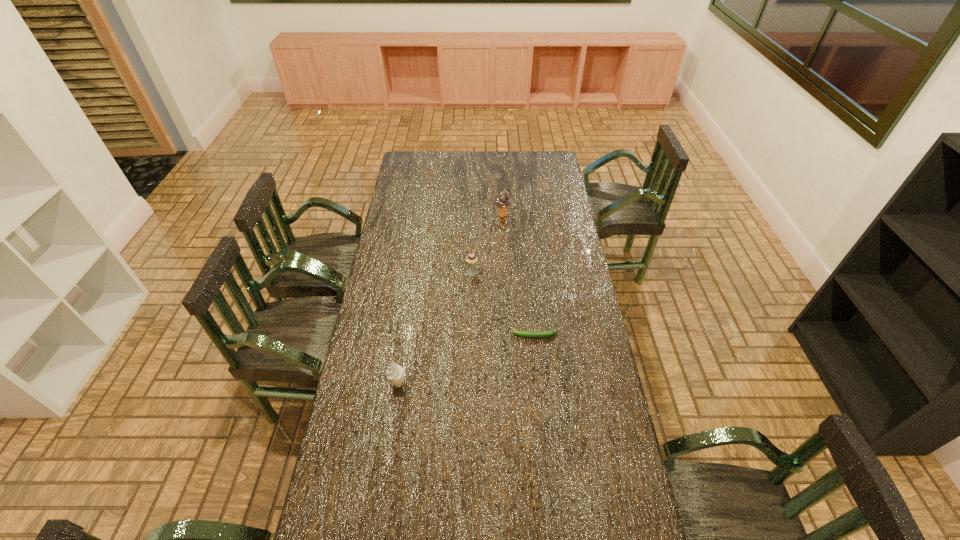
This screenshot has width=960, height=540. I want to click on vacant space at the far right corner of the desktop, so click(538, 170).

I want to click on free point between the nearest object and the farthest object, so click(450, 300).

Image resolution: width=960 pixels, height=540 pixels. In order to click on vacant point located between the farthest object and the nearest icecream in this screenshot , I will do `click(450, 300)`.

Where is `blank region between the leftmost icecream and the shortest object`? Image resolution: width=960 pixels, height=540 pixels. blank region between the leftmost icecream and the shortest object is located at coordinates (467, 360).

The image size is (960, 540). What are the coordinates of `free space between the farthest icecream and the second icecream from right to left` in the screenshot? It's located at (488, 244).

Find the location of `free area in between the shortest object and the third nearest object`. free area in between the shortest object and the third nearest object is located at coordinates (503, 304).

Find the location of a particular element. vacant area that lies between the rightmost icecream and the second nearest object is located at coordinates (518, 275).

The height and width of the screenshot is (540, 960). Find the location of `free spot between the shortest object and the second farthest object`. free spot between the shortest object and the second farthest object is located at coordinates (503, 304).

Where is `free space between the zucchini and the leftmost icecream`? free space between the zucchini and the leftmost icecream is located at coordinates (467, 360).

Where is `blank region between the farthest icecream and the nearest icecream`? Image resolution: width=960 pixels, height=540 pixels. blank region between the farthest icecream and the nearest icecream is located at coordinates (450, 300).